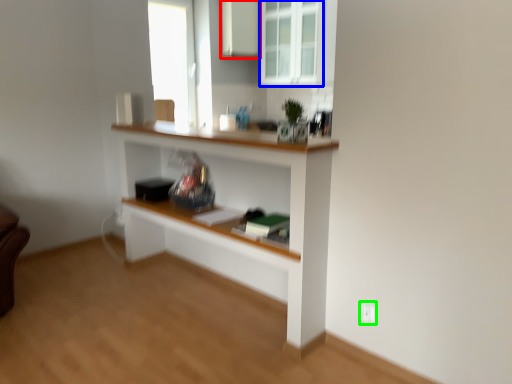
Question: Based on their relative distances, which object is farther from cabinetry (highlighted by a red box)? Choose from window (highlighted by a blue box) and electric outlet (highlighted by a green box).

Choices:
 (A) window
 (B) electric outlet

Answer: (B)